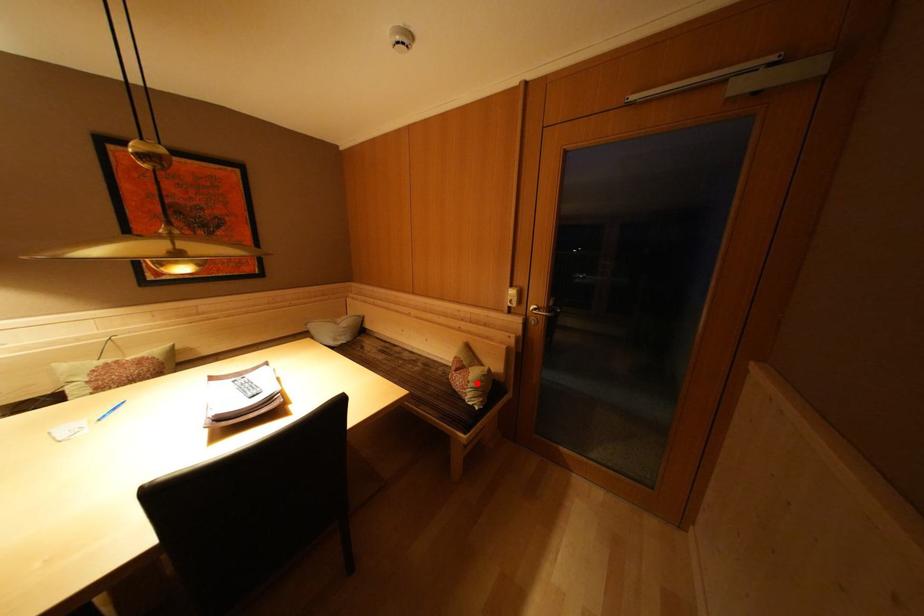
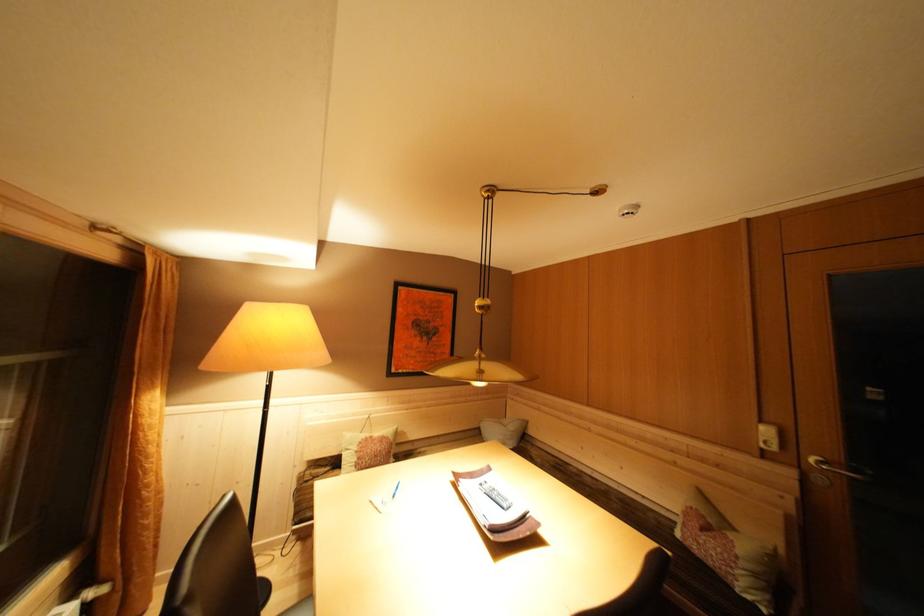
Question: I am providing you with two images of the same scene from different viewpoints. Image1 has a red point marked. In image2, the corresponding 3D location appears at what relative position? Reply with the corresponding letter.

Choices:
 (A) Closer
 (B) Farther

Answer: (A)